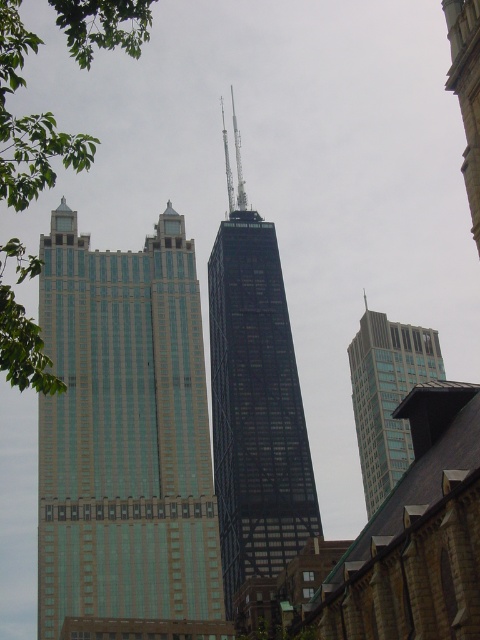
Question: Which object is the farthest from the green glass building at left?

Choices:
 (A) glassy teal skyscraper at right
 (B) green leafy tree at left
 (C) black glass skyscraper at center
 (D) smooth stone spire at upper right

Answer: (A)

Question: Which point appears closest to the camera in this image?

Choices:
 (A) (388, 410)
 (B) (451, 44)
 (C) (275, 285)

Answer: (B)

Question: Does glassy teal skyscraper at right have a larger size compared to smooth stone spire at upper right?

Choices:
 (A) no
 (B) yes

Answer: (A)

Question: Is green glass building at left further to the viewer compared to black glass skyscraper at center?

Choices:
 (A) yes
 (B) no

Answer: (B)

Question: Is black glass skyscraper at center above smooth stone spire at upper right?

Choices:
 (A) no
 (B) yes

Answer: (A)

Question: Which is nearer to the green leafy tree at left?

Choices:
 (A) green glass building at left
 (B) glassy teal skyscraper at right

Answer: (A)